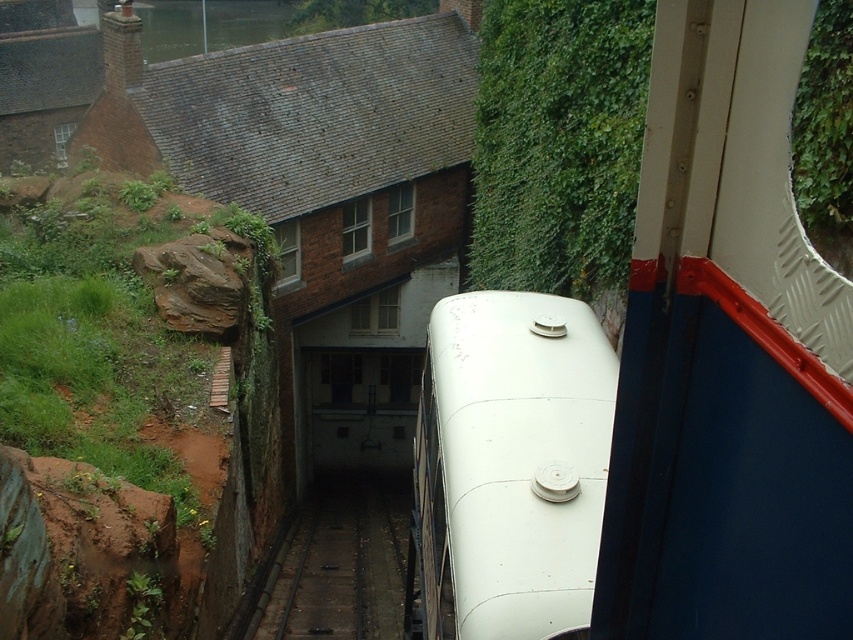
You are standing at the entrance of the brick building with a sloped roof. Looking towards the green leafy wall at upper center, can you estimate its location in terms of coordinates?

The green leafy wall at upper center is located at coordinates approximately 0.223 on the x axis and 0.654 on the y axis.

You are a maintenance worker needing to inspect the white matte train at center and the green leafy wall at upper center. Given that your ladder is 3 meters long, can you safely reach both objects from the ground without moving the ladder?

The distance between the white matte train at center and the green leafy wall at upper center is 7.62 meters. Since the ladder is only 3 meters long, you cannot safely reach both objects without moving the ladder as the distance between them exceeds the ladder length.

You are standing at the entrance of the brick building with a sloped roof. You want to board the white matte train at center. In which direction should you walk to reach the train?

The white matte train at center is located at point coordinates, so you should walk towards the train in the direction indicated by the coordinates provided.